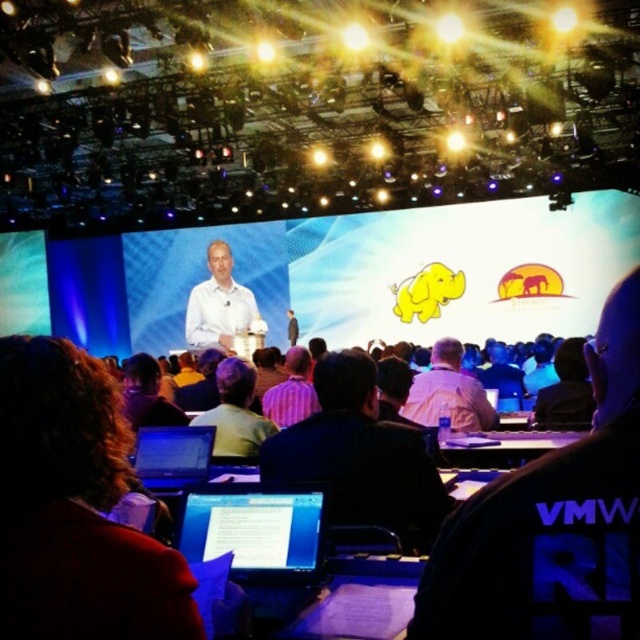
You are standing at the point marked by the coordinates point (552, 522). What is the color of the clothing item you are currently standing on?

The point (552, 522) is on light blue shirt at center, so the color of the clothing item is light blue.

You are sitting in the audience at the conference and notice two people at the center stage. One has brown hair at center and the other is wearing a white shirt at center. Which one is more to the left?

The brown hair at center is more to the left side of the white shirt at center.

You are an attendee at the conference. You notice two elements at the center of the stage. One is the brown hair at center and the other is the white shirt at center. Which one appears narrower from your perspective?

The brown hair at center appears narrower than the white shirt at center because it has a lesser width compared to the white shirt at center.